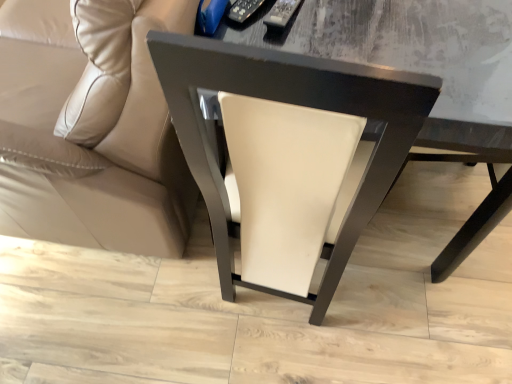
Question: Are white leather chair at center and beige leather couch at lower left located far from each other?

Choices:
 (A) yes
 (B) no

Answer: (B)

Question: Is beige leather couch at lower left located within white leather chair at center?

Choices:
 (A) no
 (B) yes

Answer: (A)

Question: Does white leather chair at center lie in front of beige leather couch at lower left?

Choices:
 (A) no
 (B) yes

Answer: (A)

Question: Considering the relative sizes of white leather chair at center and beige leather couch at lower left in the image provided, is white leather chair at center shorter than beige leather couch at lower left?

Choices:
 (A) no
 (B) yes

Answer: (B)

Question: Considering the relative sizes of white leather chair at center and beige leather couch at lower left in the image provided, is white leather chair at center bigger than beige leather couch at lower left?

Choices:
 (A) no
 (B) yes

Answer: (A)

Question: Considering the relative positions of white leather chair at center and beige leather couch at lower left in the image provided, is white leather chair at center to the left of beige leather couch at lower left from the viewer's perspective?

Choices:
 (A) yes
 (B) no

Answer: (B)

Question: Considering the relative sizes of beige leather couch at lower left and white leather chair at center in the image provided, is beige leather couch at lower left bigger than white leather chair at center?

Choices:
 (A) yes
 (B) no

Answer: (A)

Question: Does beige leather couch at lower left turn towards white leather chair at center?

Choices:
 (A) no
 (B) yes

Answer: (A)

Question: From a real-world perspective, is beige leather couch at lower left over white leather chair at center?

Choices:
 (A) yes
 (B) no

Answer: (A)

Question: From the image's perspective, is beige leather couch at lower left below white leather chair at center?

Choices:
 (A) yes
 (B) no

Answer: (B)

Question: Is beige leather couch at lower left turned away from white leather chair at center?

Choices:
 (A) yes
 (B) no

Answer: (A)

Question: Does beige leather couch at lower left come in front of white leather chair at center?

Choices:
 (A) yes
 (B) no

Answer: (A)

Question: Would you say white leather chair at center is to the left or to the right of beige leather couch at lower left in the picture?

Choices:
 (A) left
 (B) right

Answer: (B)